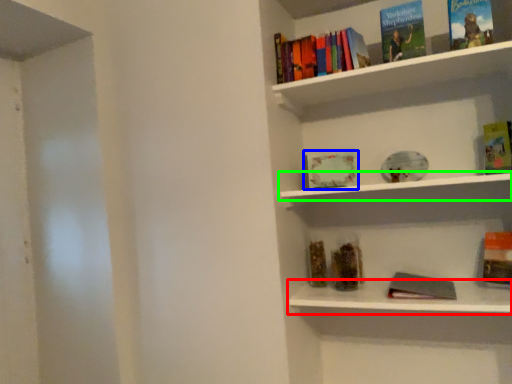
Question: Estimate the real-world distances between objects in this image. Which object is closer to window sill (highlighted by a red box), book (highlighted by a blue box) or window sill (highlighted by a green box)?

Choices:
 (A) book
 (B) window sill

Answer: (B)